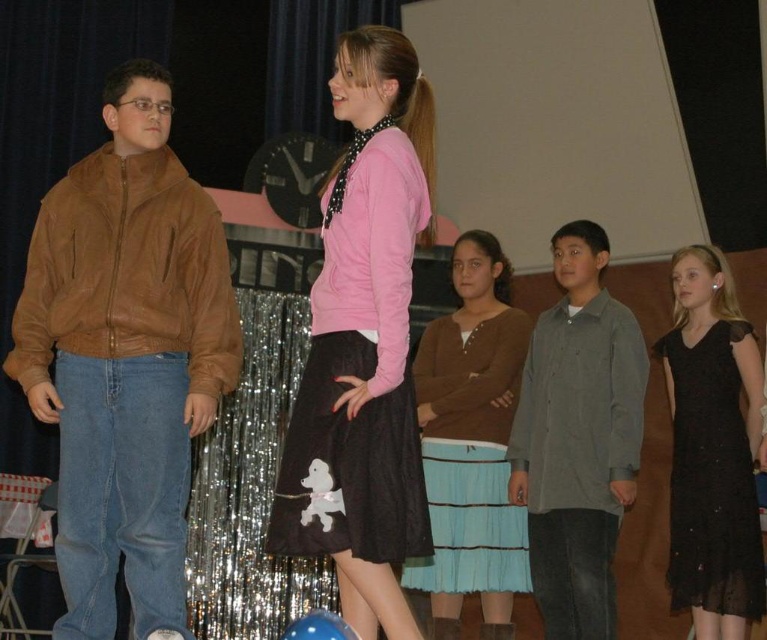
You are a photographer trying to capture a clear shot of both the gray cotton shirt at center and the blue striped skirt at center. Since the camera can only focus on one object at a time, which one should you choose to ensure the subject is in focus and recognizable?

The gray cotton shirt at center is larger in size than the blue striped skirt at center, so you should focus on the gray cotton shirt at center to ensure it is in focus and recognizable.

You are a photographer trying to capture a group photo of the children on stage. You notice the blue striped skirt at center and the black lace dress at right. Which of these two items is taller in the image?

The blue striped skirt at center is taller than the black lace dress at right according to the description.

You are a photographer positioned at the back of the stage. You need to capture a photo that includes both the brown leather jacket at left and the pink matte sweater at center. Based on their positions, which direction should you adjust your camera to ensure both are in frame?

The brown leather jacket at left is to the left of the pink matte sweater at center. To include both in the frame, adjust the camera slightly to the left to ensure the brown leather jacket at left is captured along with the pink matte sweater at center.